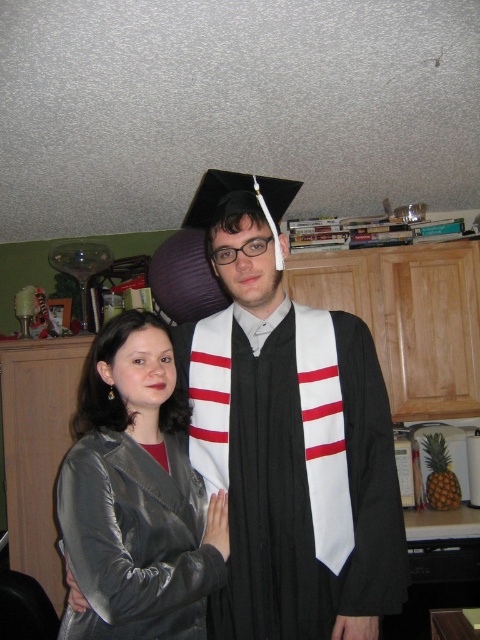
You are standing at the origin point in the image, which is the bottom left corner. The graduation gown is located at coordinates 0.683 on the x axis and 0.602 on the y axis. If you want to walk directly to the black matte graduation gown at center, in which direction should you move first?

Since the graduation gown is located at coordinates 0.683 on the x axis and 0.602 on the y axis, you should first move to the right along the x axis and then move upward along the y axis to reach the black matte graduation gown at center.

You are standing in a home setting and see the black matte graduation gown at center. If you want to take a photo of it from where you are standing, will you need to zoom in or out to frame it properly?

Since the black matte graduation gown at center is 1.30 meters away from the viewer, you would need to zoom out to frame it properly.